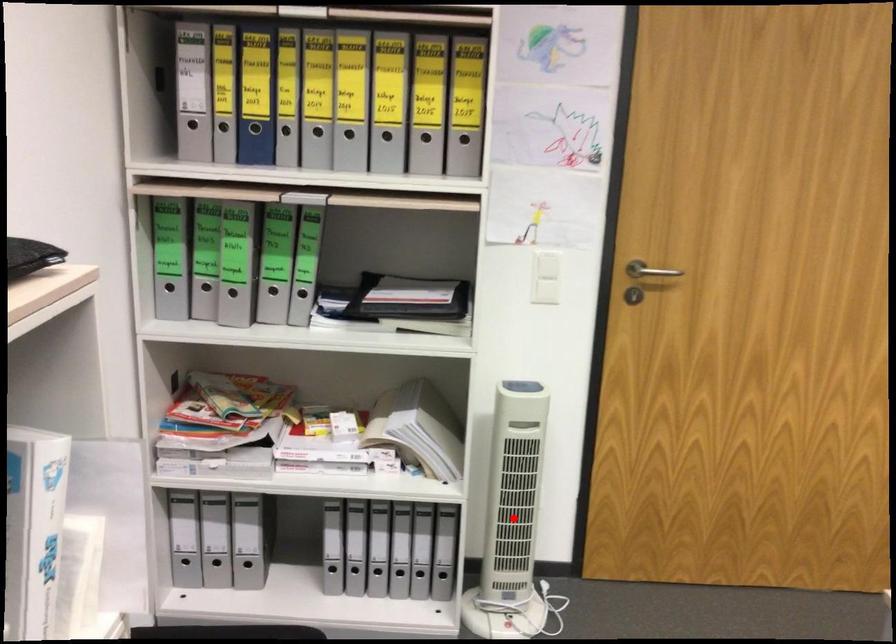
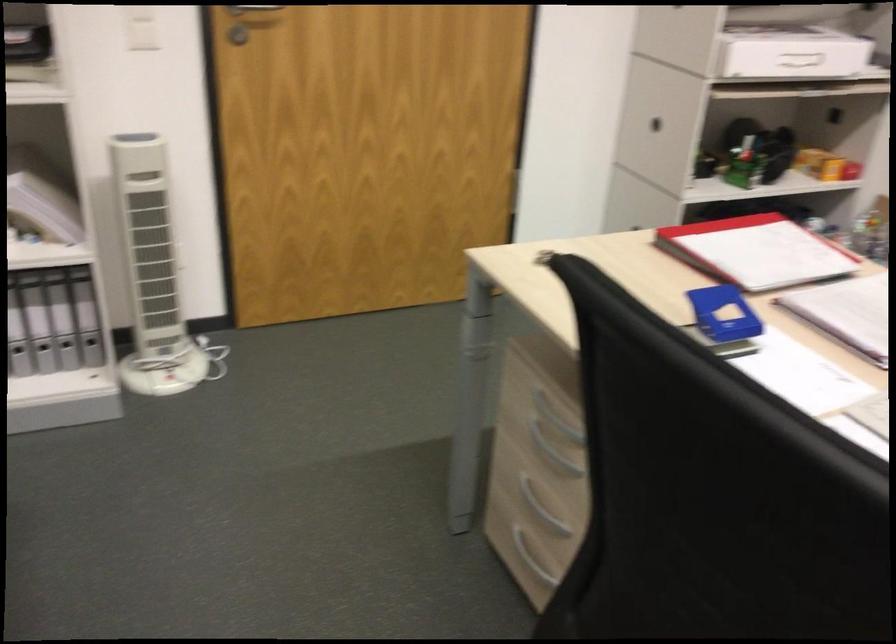
The point at the highlighted location is marked in the first image. Where is the corresponding point in the second image?

(151, 272)